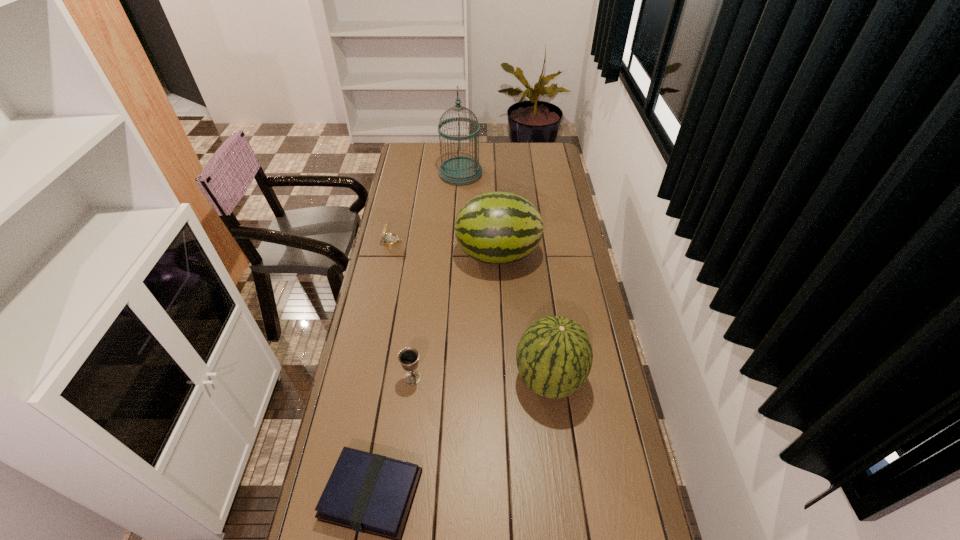
Where is `vacant space at the far right corner of the desktop`? vacant space at the far right corner of the desktop is located at coordinates (533, 145).

You are a GUI agent. You are given a task and a screenshot of the screen. Output one action in this format:
    pyautogui.click(x=<x>, y=<y>)
    Task: Click on the vacant region between the fourth tallest object and the birdcage
    The height and width of the screenshot is (540, 960).
    Given the screenshot: What is the action you would take?
    pyautogui.click(x=437, y=275)

The height and width of the screenshot is (540, 960). In order to click on empty space between the farthest object and the compass in this screenshot , I will do `click(426, 207)`.

At what (x,y) coordinates should I click in order to perform the action: click on vacant space that's between the farther watermelon and the second shortest object. Please return your answer as a coordinate pair (x, y). Looking at the image, I should click on (444, 248).

In order to click on vacant space in between the tallest object and the chalice in this screenshot , I will do `click(437, 275)`.

You are a GUI agent. You are given a task and a screenshot of the screen. Output one action in this format:
    pyautogui.click(x=<x>, y=<y>)
    Task: Click on the vacant area that lies between the nearer watermelon and the fifth tallest object
    The height and width of the screenshot is (540, 960).
    Given the screenshot: What is the action you would take?
    pyautogui.click(x=470, y=310)

Identify the location of blank region between the farther watermelon and the nearer watermelon. The image size is (960, 540). (523, 317).

Identify the location of vacant space in between the nearer watermelon and the tallest object. (505, 276).

Locate which object is the fifth closest to the nearest object. Please provide its 2D coordinates. Your answer should be formatted as a tuple, i.e. [(x, y)], where the tuple contains the x and y coordinates of a point satisfying the conditions above.

[(460, 170)]

Locate which object ranks fifth in proximity to the compass. Please provide its 2D coordinates. Your answer should be formatted as a tuple, i.e. [(x, y)], where the tuple contains the x and y coordinates of a point satisfying the conditions above.

[(370, 493)]